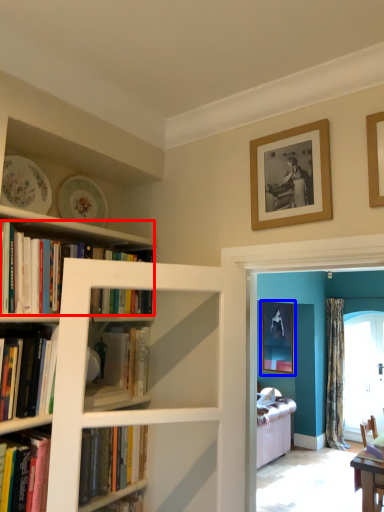
Question: Which object is further to the camera taking this photo, book (highlighted by a red box) or picture frame (highlighted by a blue box)?

Choices:
 (A) book
 (B) picture frame

Answer: (B)